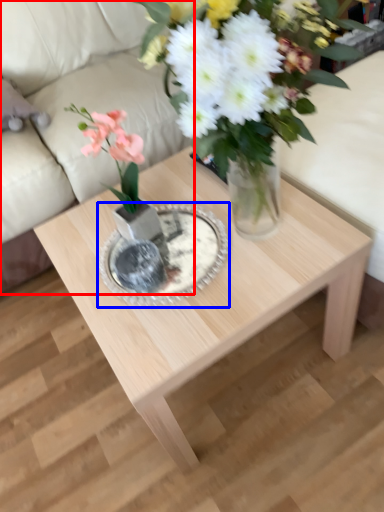
Question: Which object is further to the camera taking this photo, couch (highlighted by a red box) or glass plate (highlighted by a blue box)?

Choices:
 (A) couch
 (B) glass plate

Answer: (A)